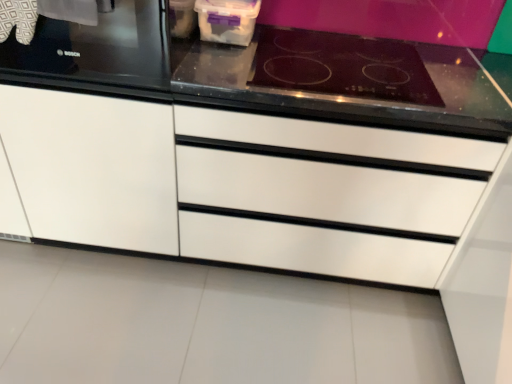
Measure the distance between white matte cabinet at left and camera.

1.35 meters.

You are a GUI agent. You are given a task and a screenshot of the screen. Output one action in this format:
    pyautogui.click(x=<x>, y=<y>)
    Task: Click on the black glass stove at upper left
    The image size is (512, 384).
    Given the screenshot: What is the action you would take?
    pyautogui.click(x=96, y=49)

You are a GUI agent. You are given a task and a screenshot of the screen. Output one action in this format:
    pyautogui.click(x=<x>, y=<y>)
    Task: Click on the white matte cabinet at left
    This screenshot has height=384, width=512.
    Given the screenshot: What is the action you would take?
    pyautogui.click(x=92, y=168)

Which is more to the right, white matte cabinet at left or white glossy drawer at center?

white glossy drawer at center.

Considering the relative sizes of white matte cabinet at left and white glossy drawer at center in the image provided, is white matte cabinet at left bigger than white glossy drawer at center?

Yes, white matte cabinet at left is bigger than white glossy drawer at center.

Can white glossy drawer at center be found inside white matte cabinet at left?

No, white glossy drawer at center is not inside white matte cabinet at left.

Is white matte cabinet at left aimed at white glossy drawer at center?

No, white matte cabinet at left is not facing towards white glossy drawer at center.

Does black glass cooktop at upper right turn towards white matte cabinet at left?

No.

Considering the relative sizes of black glass cooktop at upper right and white matte cabinet at left in the image provided, is black glass cooktop at upper right taller than white matte cabinet at left?

No.

Based on the photo, can you confirm if black glass cooktop at upper right is positioned to the right of white matte cabinet at left?

Yes, black glass cooktop at upper right is to the right of white matte cabinet at left.

Can white matte cabinet at left be found inside black glass cooktop at upper right?

No, white matte cabinet at left is not a part of black glass cooktop at upper right.

How many degrees apart are the facing directions of white matte cabinet at left and black glass stove at upper left?

The angular difference between white matte cabinet at left and black glass stove at upper left is 2.38 degrees.

Which object is further away from the camera taking this photo, white matte cabinet at left or black glass stove at upper left?

black glass stove at upper left is further away from the camera.

From the image's perspective, which is below, white matte cabinet at left or black glass stove at upper left?

white matte cabinet at left, from the image's perspective.

Is white matte cabinet at left inside the boundaries of black glass stove at upper left, or outside?

white matte cabinet at left lies outside black glass stove at upper left.

Considering the relative sizes of black glass stove at upper left and white glossy drawer at center in the image provided, is black glass stove at upper left bigger than white glossy drawer at center?

Incorrect, black glass stove at upper left is not larger than white glossy drawer at center.

Is black glass stove at upper left turned away from white glossy drawer at center?

No.

From a real-world perspective, is black glass stove at upper left over white glossy drawer at center?

Yes, from a real-world perspective, black glass stove at upper left is over white glossy drawer at center

Is black glass stove at upper left outside of white glossy drawer at center?

That's correct, black glass stove at upper left is outside of white glossy drawer at center.

Could you tell me if white matte cabinet at left is facing black glass cooktop at upper right?

No, white matte cabinet at left is not turned towards black glass cooktop at upper right.

How many degrees apart are the facing directions of white matte cabinet at left and black glass cooktop at upper right?

The facing directions of white matte cabinet at left and black glass cooktop at upper right are 3.04 degrees apart.

Is white matte cabinet at left taller than black glass cooktop at upper right?

Yes, white matte cabinet at left is taller than black glass cooktop at upper right.

What are the coordinates of `gas stove that is above the white matte cabinet at left (from a real-world perspective)` in the screenshot? It's located at (342, 66).

Is black glass stove at upper left aimed at white matte cabinet at left?

Yes, black glass stove at upper left is aimed at white matte cabinet at left.

Which object is positioned more to the left, black glass stove at upper left or white matte cabinet at left?

Positioned to the left is white matte cabinet at left.

From a real-world perspective, is black glass stove at upper left positioned above or below white matte cabinet at left?

From a real-world perspective, black glass stove at upper left is physically above white matte cabinet at left.

Do you think black glass stove at upper left is within white matte cabinet at left, or outside of it?

black glass stove at upper left is located inside white matte cabinet at left.

Which point is more forward, (325, 53) or (459, 146)?

Positioned in front is point (459, 146).

The image size is (512, 384). I want to click on gas stove above the white glossy drawer at center (from the image's perspective), so click(x=342, y=66).

Are black glass cooktop at upper right and white glossy drawer at center far apart?

No.

The image size is (512, 384). What are the coordinates of `cabinetry that appears in front of the white glossy drawer at center` in the screenshot? It's located at point(92,168).

You are a GUI agent. You are given a task and a screenshot of the screen. Output one action in this format:
    pyautogui.click(x=<x>, y=<y>)
    Task: Click on the gas stove on the right of white matte cabinet at left
    
    Given the screenshot: What is the action you would take?
    pyautogui.click(x=342, y=66)

Which object lies further to the anchor point black glass stove at upper left, black glass cooktop at upper right or white glossy drawer at center?

Among the two, black glass cooktop at upper right is located further to black glass stove at upper left.

Looking at the image, which one is located closer to white matte cabinet at left, black glass stove at upper left or black glass cooktop at upper right?

black glass stove at upper left is positioned closer to the anchor white matte cabinet at left.

Looking at the image, which one is located further to black glass stove at upper left, black glass cooktop at upper right or white matte cabinet at left?

black glass cooktop at upper right.

Which object lies further to the anchor point black glass stove at upper left, white glossy drawer at center or black glass cooktop at upper right?

Among the two, black glass cooktop at upper right is located further to black glass stove at upper left.

Which object lies further to the anchor point black glass cooktop at upper right, white glossy drawer at center or black glass stove at upper left?

black glass stove at upper left.

Which object lies nearer to the anchor point black glass cooktop at upper right, white matte cabinet at left or black glass stove at upper left?

Based on the image, black glass stove at upper left appears to be nearer to black glass cooktop at upper right.

Based on their spatial positions, is black glass cooktop at upper right or black glass stove at upper left further from white glossy drawer at center?

black glass stove at upper left.

Estimate the real-world distances between objects in this image. Which object is further from white matte cabinet at left, black glass cooktop at upper right or white glossy drawer at center?

Based on the image, black glass cooktop at upper right appears to be further to white matte cabinet at left.

Where is `drawer between black glass stove at upper left and black glass cooktop at upper right from left to right`? The image size is (512, 384). drawer between black glass stove at upper left and black glass cooktop at upper right from left to right is located at coordinates (325, 195).

Identify the location of home appliance between white matte cabinet at left and white glossy drawer at center. 96,49.

The width and height of the screenshot is (512, 384). I want to click on home appliance between white matte cabinet at left and black glass cooktop at upper right in the horizontal direction, so coord(96,49).

You are a GUI agent. You are given a task and a screenshot of the screen. Output one action in this format:
    pyautogui.click(x=<x>, y=<y>)
    Task: Click on the drawer between white matte cabinet at left and black glass cooktop at upper right from left to right
    
    Given the screenshot: What is the action you would take?
    [x=325, y=195]